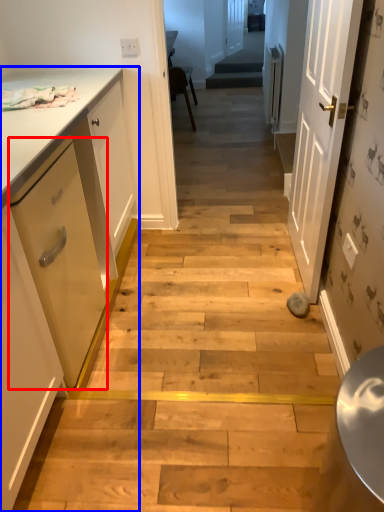
Question: Which object appears closest to the camera in this image, drawer (highlighted by a red box) or cabinetry (highlighted by a blue box)?

Choices:
 (A) drawer
 (B) cabinetry

Answer: (B)